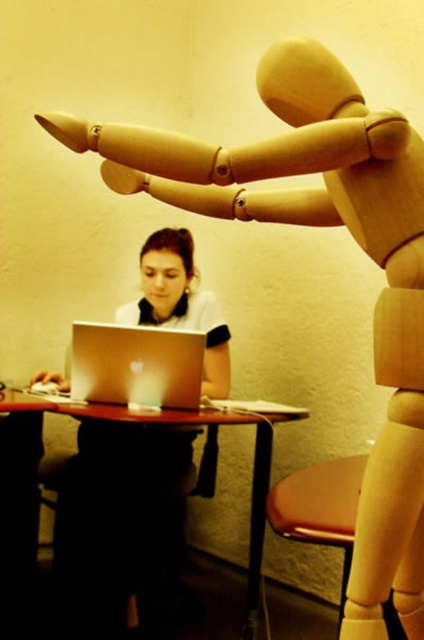
You are a delivery robot navigating a room. You need to place a small package on the matte white laptop at center. The robot has a map with coordinates where the laptop is located at point 0.811, 0.288. Can you confirm the coordinates for placing the package?

Yes, the matte white laptop at center is located at coordinates (122, 518), so the package can be placed there.

Looking at this image, you are organizing a small exhibition and need to place both the matte white laptop at center and the wooden table at lower center on a display stand. Given their sizes, which object should be placed first to ensure stability?

The wooden table at lower center should be placed first because it is smaller in size than the matte white laptop at center, allowing the larger laptop to be positioned stably on top or beside it without overbalancing.

You are a delivery robot with a package that is 18 inches wide. You need to place it on the wooden table at lower center, but there is a matte white laptop at center already on the table. Can the package fit on the table without moving the laptop?

The matte white laptop at center is 17.83 inches from the wooden table at lower center. Since the package is 18 inches wide, it is slightly wider than the available space between the laptop and the edge of the table. Therefore, the package cannot fit without moving the laptop.